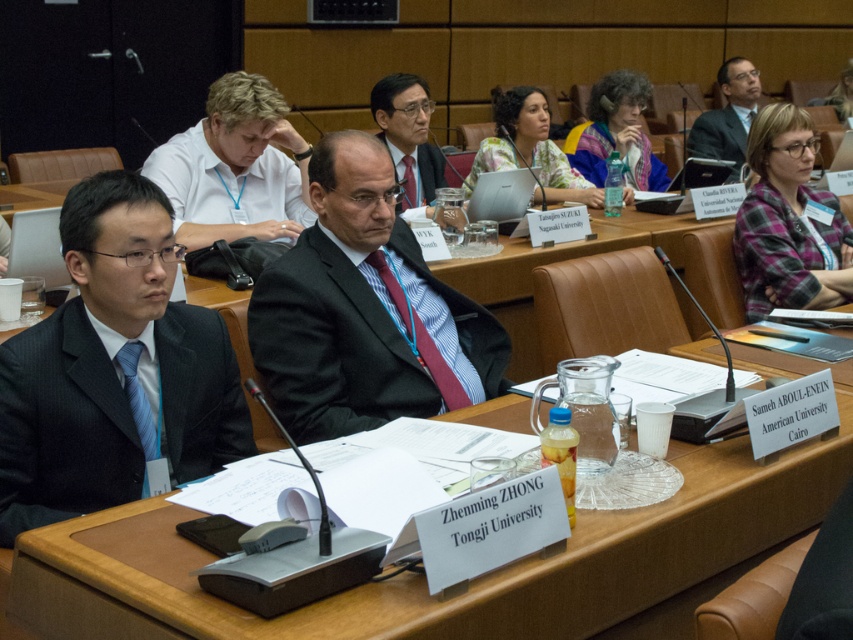
Does black textured suit at left appear on the right side of plaid fabric shirt at right?

In fact, black textured suit at left is to the left of plaid fabric shirt at right.

Is the position of black textured suit at left less distant than that of plaid fabric shirt at right?

That is True.

I want to click on black textured suit at left, so click(x=62, y=426).

Does point (660, 164) lie behind point (158, 412)?

That is True.

The image size is (853, 640). What do you see at coordinates (616, 132) in the screenshot?
I see `multicolored fabric scarf at center` at bounding box center [616, 132].

Where is `multicolored fabric scarf at center`? The image size is (853, 640). multicolored fabric scarf at center is located at coordinates (616, 132).

Can you confirm if black satin suit at center is taller than dark suit at upper right?

In fact, black satin suit at center may be shorter than dark suit at upper right.

Which is in front, point (344, 371) or point (747, 99)?

Point (344, 371)

Is point (358, 417) less distant than point (734, 106)?

Yes, it is.

Locate an element on the screen. This screenshot has height=640, width=853. black satin suit at center is located at coordinates (320, 342).